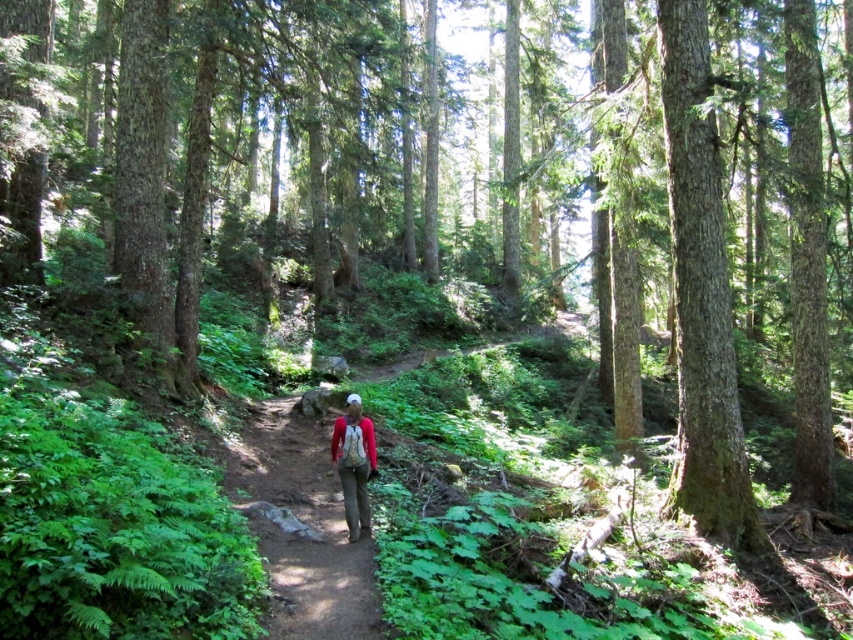
Who is higher up, smooth brown tree trunk at right or brown dirt trail at center?

smooth brown tree trunk at right is above.

Does smooth brown tree trunk at right appear on the right side of brown dirt trail at center?

Correct, you'll find smooth brown tree trunk at right to the right of brown dirt trail at center.

Image resolution: width=853 pixels, height=640 pixels. Find the location of `smooth brown tree trunk at right`. smooth brown tree trunk at right is located at coordinates (701, 296).

This screenshot has height=640, width=853. I want to click on smooth brown tree trunk at right, so click(x=701, y=296).

Looking at this image, is smooth brown tree trunk at right above matte red shirt at center?

Yes, smooth brown tree trunk at right is above matte red shirt at center.

You are a GUI agent. You are given a task and a screenshot of the screen. Output one action in this format:
    pyautogui.click(x=<x>, y=<y>)
    Task: Click on the smooth brown tree trunk at right
    
    Given the screenshot: What is the action you would take?
    pyautogui.click(x=701, y=296)

You are a GUI agent. You are given a task and a screenshot of the screen. Output one action in this format:
    pyautogui.click(x=<x>, y=<y>)
    Task: Click on the smooth brown tree trunk at right
    
    Given the screenshot: What is the action you would take?
    pyautogui.click(x=701, y=296)

Which is behind, point (361, 605) or point (334, 442)?

Point (334, 442)

At what (x,y) coordinates should I click in order to perform the action: click on brown dirt trail at center. Please return your answer as a coordinate pair (x, y). Looking at the image, I should click on (300, 525).